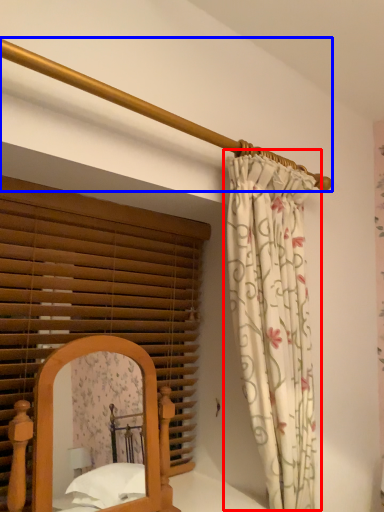
Question: Which point is further to the camera, curtain (highlighted by a red box) or balustrade (highlighted by a blue box)?

Choices:
 (A) curtain
 (B) balustrade

Answer: (A)